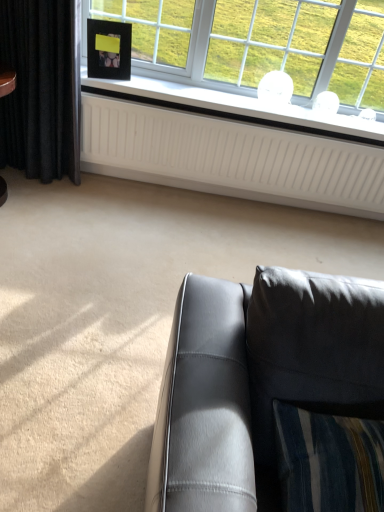
Question: Considering the relative positions of matte gray leather couch at lower right and black matte picture frame at upper left in the image provided, is matte gray leather couch at lower right to the right of black matte picture frame at upper left from the viewer's perspective?

Choices:
 (A) yes
 (B) no

Answer: (A)

Question: Is matte gray leather couch at lower right to the left of black matte picture frame at upper left from the viewer's perspective?

Choices:
 (A) yes
 (B) no

Answer: (B)

Question: Considering the relative positions of matte gray leather couch at lower right and black matte picture frame at upper left in the image provided, is matte gray leather couch at lower right behind black matte picture frame at upper left?

Choices:
 (A) no
 (B) yes

Answer: (A)

Question: From the image's perspective, does matte gray leather couch at lower right appear lower than black matte picture frame at upper left?

Choices:
 (A) yes
 (B) no

Answer: (A)

Question: Could black matte picture frame at upper left be considered to be inside matte gray leather couch at lower right?

Choices:
 (A) yes
 (B) no

Answer: (B)

Question: In terms of size, does black velvet curtain at left appear bigger or smaller than white textured radiator at upper center?

Choices:
 (A) big
 (B) small

Answer: (B)

Question: Is black velvet curtain at left wider or thinner than white textured radiator at upper center?

Choices:
 (A) wide
 (B) thin

Answer: (A)

Question: Is point (59, 7) positioned closer to the camera than point (158, 123)?

Choices:
 (A) closer
 (B) farther

Answer: (A)

Question: From their relative heights in the image, would you say black velvet curtain at left is taller or shorter than white textured radiator at upper center?

Choices:
 (A) tall
 (B) short

Answer: (A)

Question: Looking at their shapes, would you say matte gray leather couch at lower right is wider or thinner than black velvet curtain at left?

Choices:
 (A) thin
 (B) wide

Answer: (B)

Question: Do you think matte gray leather couch at lower right is within black velvet curtain at left, or outside of it?

Choices:
 (A) inside
 (B) outside

Answer: (B)

Question: From the image's perspective, is matte gray leather couch at lower right positioned above or below black velvet curtain at left?

Choices:
 (A) below
 (B) above

Answer: (A)

Question: Is matte gray leather couch at lower right taller or shorter than black velvet curtain at left?

Choices:
 (A) short
 (B) tall

Answer: (A)

Question: Is white textured radiator at upper center wider or thinner than matte gray leather couch at lower right?

Choices:
 (A) thin
 (B) wide

Answer: (A)

Question: Would you say white textured radiator at upper center is inside or outside matte gray leather couch at lower right?

Choices:
 (A) inside
 (B) outside

Answer: (B)